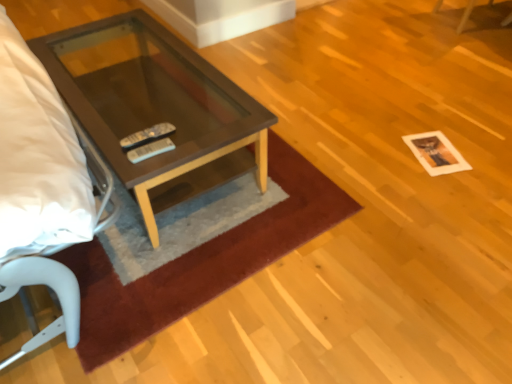
The width and height of the screenshot is (512, 384). I want to click on vacant area that lies to the right of white paper at lower right, so click(475, 149).